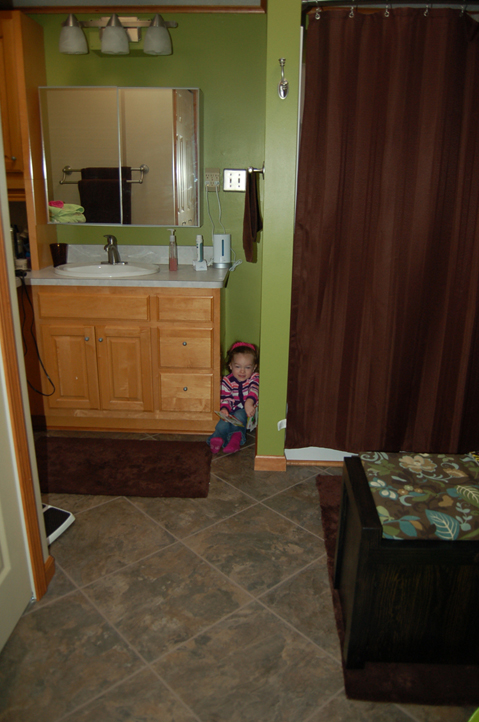
Where is `door`? The width and height of the screenshot is (479, 722). door is located at coordinates (7, 591).